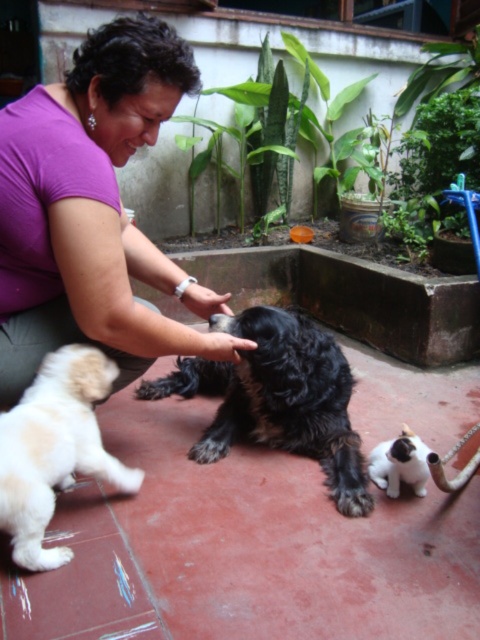
Does purple fabric at center have a larger size compared to light beige fur at lower left?

Yes.

Does purple fabric at center have a greater height compared to light beige fur at lower left?

Yes.

At what (x,y) coordinates should I click in order to perform the action: click on purple fabric at center. Please return your answer as a coordinate pair (x, y). Looking at the image, I should click on (93, 211).

Can you confirm if purple fabric at center is positioned to the left of white fur cat at lower right?

Indeed, purple fabric at center is positioned on the left side of white fur cat at lower right.

Between point (111, 214) and point (422, 492), which one is positioned behind?

The point (422, 492) is more distant.

Who is more distant from viewer, [122,262] or [388,477]?

The point [388,477] is more distant.

In order to click on purple fabric at center in this screenshot , I will do `click(93, 211)`.

Which of these two, light beige fur at lower left or white fur cat at lower right, stands taller?

With more height is light beige fur at lower left.

Between light beige fur at lower left and white fur cat at lower right, which one has less height?

Standing shorter between the two is white fur cat at lower right.

Is point (35, 545) positioned after point (382, 481)?

No, it is not.

The image size is (480, 640). Identify the location of light beige fur at lower left. (55, 449).